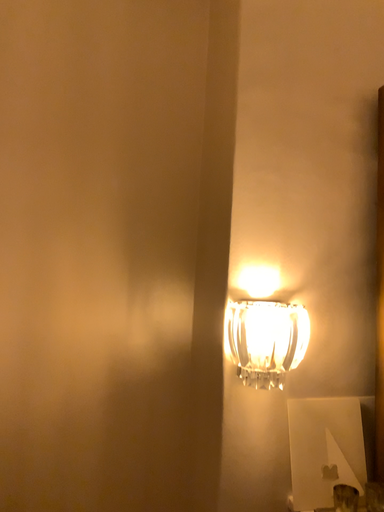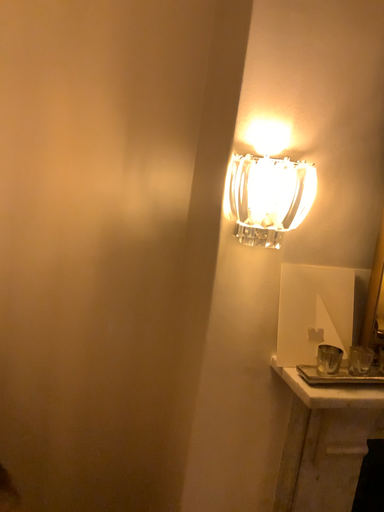
Question: How did the camera likely rotate when shooting the video?

Choices:
 (A) rotated downward
 (B) rotated upward

Answer: (A)